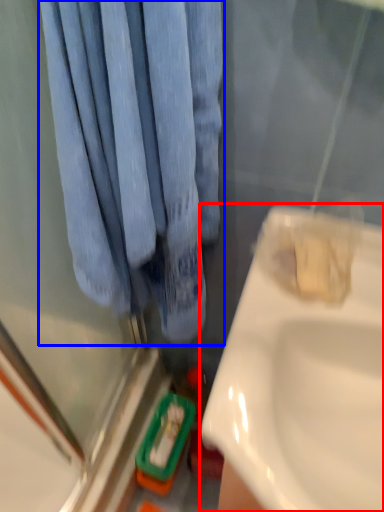
Question: Which point is further to the camera, sink (highlighted by a red box) or curtain (highlighted by a blue box)?

Choices:
 (A) sink
 (B) curtain

Answer: (A)